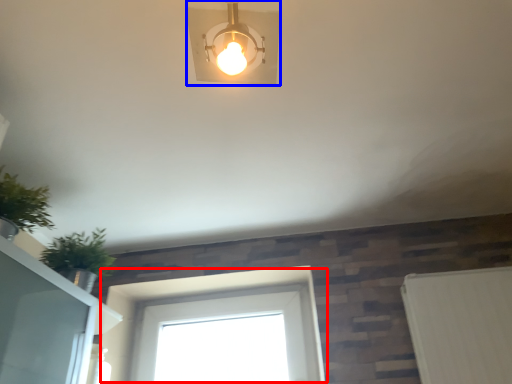
Question: Which object appears closest to the camera in this image, window (highlighted by a red box) or lamp (highlighted by a blue box)?

Choices:
 (A) window
 (B) lamp

Answer: (B)